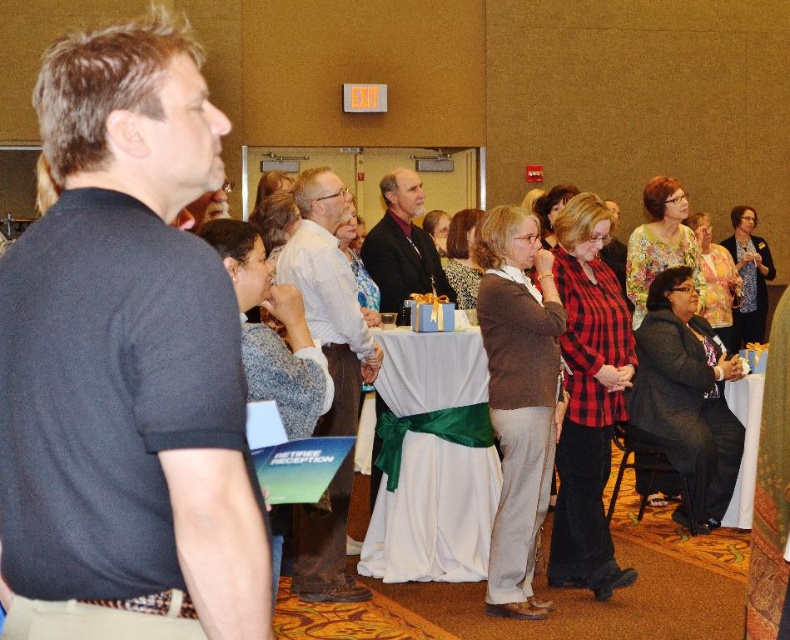
Can you confirm if white satin table at center is positioned to the left of dark brown leather jacket at center?

Incorrect, white satin table at center is not on the left side of dark brown leather jacket at center.

Between point (448, 474) and point (399, 237), which one is positioned in front?

Point (448, 474) is in front.

Identify the location of white satin table at center. pos(431,460).

Between white satin table at center and white shirt at center, which one is positioned lower?

Positioned lower is white satin table at center.

Consider the image. Is white satin table at center to the left of white shirt at center from the viewer's perspective?

In fact, white satin table at center is to the right of white shirt at center.

Which is in front, point (371, 547) or point (337, 252)?

Point (337, 252)

The image size is (790, 640). Find the location of `white satin table at center`. white satin table at center is located at coordinates (431, 460).

At what (x,y) coordinates should I click in order to perform the action: click on white shirt at center. Please return your answer as a coordinate pair (x, y). This screenshot has height=640, width=790. Looking at the image, I should click on (329, 294).